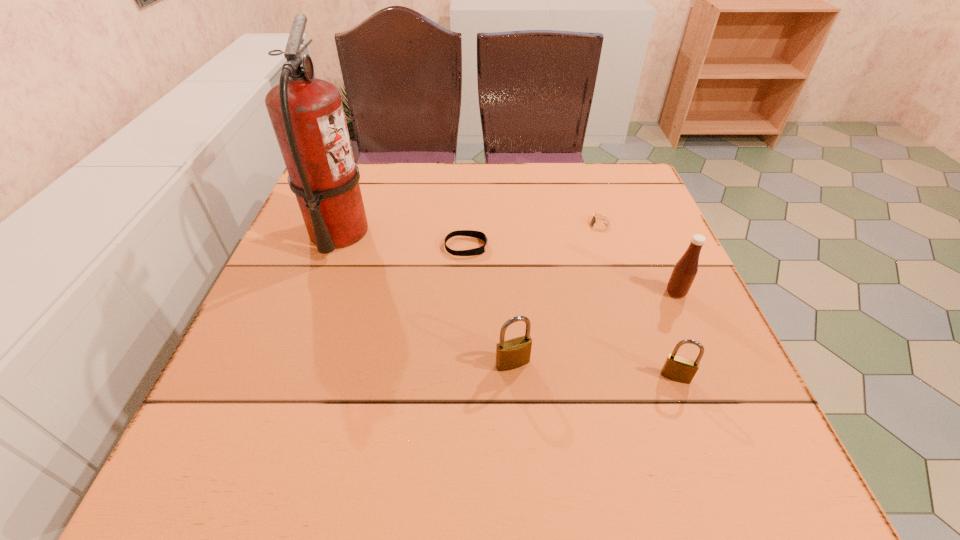
This screenshot has width=960, height=540. What are the coordinates of `free point between the shorter padlock and the third nearest object` in the screenshot? It's located at (676, 335).

Locate an element on the screen. This screenshot has height=540, width=960. blank region between the shorter padlock and the Tabasco sauce is located at coordinates (676, 335).

The width and height of the screenshot is (960, 540). Find the location of `vacant region between the third nearest object and the fifth object from right to left`. vacant region between the third nearest object and the fifth object from right to left is located at coordinates (571, 270).

At what (x,y) coordinates should I click in order to perform the action: click on object that is the fourth nearest to the third shortest object. Please return your answer as a coordinate pair (x, y). The image size is (960, 540). Looking at the image, I should click on (470, 233).

Where is `object that is the second closest to the tallest object`? The image size is (960, 540). object that is the second closest to the tallest object is located at coordinates (511, 354).

The image size is (960, 540). Identify the location of vacant space that satisfies the following two spatial constraints: 1. toward the nozzle of the tallest object; 2. on the right side of the fourth object from right to left. (290, 363).

You are a GUI agent. You are given a task and a screenshot of the screen. Output one action in this format:
    pyautogui.click(x=<x>, y=<y>)
    Task: Click on the vacant point that satisfies the following two spatial constraints: 1. on the back side of the left padlock; 2. toward the nozzle of the fire extinguisher
    
    Given the screenshot: What is the action you would take?
    pyautogui.click(x=504, y=233)

Where is `vacant area that satisfies the following two spatial constraints: 1. on the back side of the Tabasco sauce; 2. on the left side of the taller padlock`? The width and height of the screenshot is (960, 540). vacant area that satisfies the following two spatial constraints: 1. on the back side of the Tabasco sauce; 2. on the left side of the taller padlock is located at coordinates (508, 293).

The image size is (960, 540). I want to click on free point that satisfies the following two spatial constraints: 1. on the display of the wristband; 2. on the back side of the shorter padlock, so click(x=462, y=377).

This screenshot has height=540, width=960. What are the coordinates of `free space that satisfies the following two spatial constraints: 1. toward the nozzle of the tallest object; 2. on the back side of the third shortest object` in the screenshot? It's located at (285, 377).